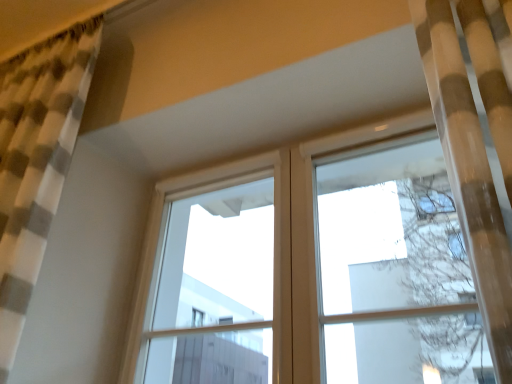
What do you see at coordinates (160, 229) in the screenshot? I see `white plastic window frame at upper center` at bounding box center [160, 229].

You are a GUI agent. You are given a task and a screenshot of the screen. Output one action in this format:
    pyautogui.click(x=<x>, y=<y>)
    Task: Click on the white plastic window frame at upper center
    Image resolution: width=512 pixels, height=384 pixels.
    Given the screenshot: What is the action you would take?
    pyautogui.click(x=160, y=229)

The width and height of the screenshot is (512, 384). Describe the element at coordinates (36, 160) in the screenshot. I see `checkered fabric curtain at left` at that location.

Image resolution: width=512 pixels, height=384 pixels. What are the coordinates of `checkered fabric curtain at left` in the screenshot? It's located at (36, 160).

What is the approximate height of checkered fabric curtain at left?

4.75 feet.

The image size is (512, 384). Find the location of `white plastic window frame at upper center`. white plastic window frame at upper center is located at coordinates (160, 229).

From the picture: Is white plastic window frame at upper center to the left or to the right of checkered fabric curtain at left in the image?

In the image, white plastic window frame at upper center appears on the right side of checkered fabric curtain at left.

Relative to checkered fabric curtain at left, is white plastic window frame at upper center in front or behind?

white plastic window frame at upper center is positioned farther from the viewer than checkered fabric curtain at left.

Considering the positions of points (149, 278) and (21, 189), is point (149, 278) closer to camera compared to point (21, 189)?

That is False.

Looking at this image, from the image's perspective, would you say white plastic window frame at upper center is shown under checkered fabric curtain at left?

Yes.

Based on the photo, from a real-world perspective, which is physically below, white plastic window frame at upper center or checkered fabric curtain at left?

white plastic window frame at upper center, from a real-world perspective.

Based on the photo, is white plastic window frame at upper center wider than checkered fabric curtain at left?

No.

In the scene shown: Who is taller, white plastic window frame at upper center or checkered fabric curtain at left?

checkered fabric curtain at left.

Considering the sizes of objects white plastic window frame at upper center and checkered fabric curtain at left in the image provided, who is bigger, white plastic window frame at upper center or checkered fabric curtain at left?

checkered fabric curtain at left.

Is white plastic window frame at upper center not within checkered fabric curtain at left?

white plastic window frame at upper center is positioned outside checkered fabric curtain at left.

Are white plastic window frame at upper center and checkered fabric curtain at left located far from each other?

No, white plastic window frame at upper center is not far away from checkered fabric curtain at left.

Is white plastic window frame at upper center oriented away from checkered fabric curtain at left?

That's not correct — white plastic window frame at upper center is not looking away from checkered fabric curtain at left.

Measure the distance between white plastic window frame at upper center and checkered fabric curtain at left.

white plastic window frame at upper center and checkered fabric curtain at left are 58.86 centimeters apart from each other.

Where is `curtain above the white plastic window frame at upper center (from a real-world perspective)`? The image size is (512, 384). curtain above the white plastic window frame at upper center (from a real-world perspective) is located at coordinates 36,160.

Which object is positioned more to the right, checkered fabric curtain at left or white plastic window frame at upper center?

From the viewer's perspective, white plastic window frame at upper center appears more on the right side.

Based on the photo, relative to white plastic window frame at upper center, is checkered fabric curtain at left in front or behind?

checkered fabric curtain at left is positioned closer to the viewer than white plastic window frame at upper center.

Which is closer, (x=31, y=292) or (x=205, y=174)?

Point (x=31, y=292) is positioned closer to the camera compared to point (x=205, y=174).

From the image's perspective, is checkered fabric curtain at left above white plastic window frame at upper center?

Correct, checkered fabric curtain at left appears higher than white plastic window frame at upper center in the image.

From a real-world perspective, who is located higher, checkered fabric curtain at left or white plastic window frame at upper center?

In real-world perspective, checkered fabric curtain at left is above.

From the picture: Is checkered fabric curtain at left thinner than white plastic window frame at upper center?

No, checkered fabric curtain at left is not thinner than white plastic window frame at upper center.

Between checkered fabric curtain at left and white plastic window frame at upper center, which one has more height?

Standing taller between the two is checkered fabric curtain at left.

Who is smaller, checkered fabric curtain at left or white plastic window frame at upper center?

Smaller between the two is white plastic window frame at upper center.

Is checkered fabric curtain at left inside the boundaries of white plastic window frame at upper center, or outside?

checkered fabric curtain at left exists outside the volume of white plastic window frame at upper center.

Are checkered fabric curtain at left and white plastic window frame at upper center far apart?

checkered fabric curtain at left is near white plastic window frame at upper center, not far away.

Is checkered fabric curtain at left facing away from white plastic window frame at upper center?

checkered fabric curtain at left does not have its back to white plastic window frame at upper center.

Can you tell me how much checkered fabric curtain at left and white plastic window frame at upper center differ in facing direction?

There is a 0.203-degree angle between the facing directions of checkered fabric curtain at left and white plastic window frame at upper center.

The width and height of the screenshot is (512, 384). Identify the location of window frame behind the checkered fabric curtain at left. (160, 229).

Where is `window frame on the right side of checkered fabric curtain at left`? window frame on the right side of checkered fabric curtain at left is located at coordinates (160, 229).

You are a GUI agent. You are given a task and a screenshot of the screen. Output one action in this format:
    pyautogui.click(x=<x>, y=<y>)
    Task: Click on the curtain that appears on the left of white plastic window frame at upper center
    
    Given the screenshot: What is the action you would take?
    pyautogui.click(x=36, y=160)